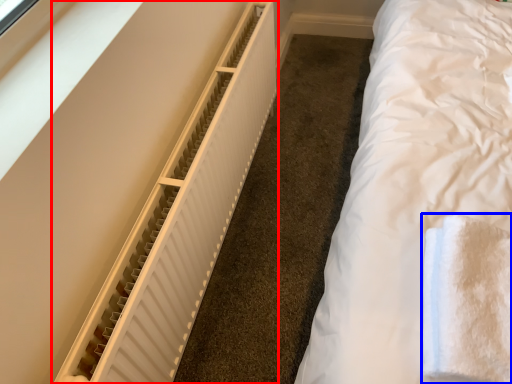
Question: Which object appears closest to the camera in this image, radiator (highlighted by a red box) or cloth (highlighted by a blue box)?

Choices:
 (A) radiator
 (B) cloth

Answer: (B)